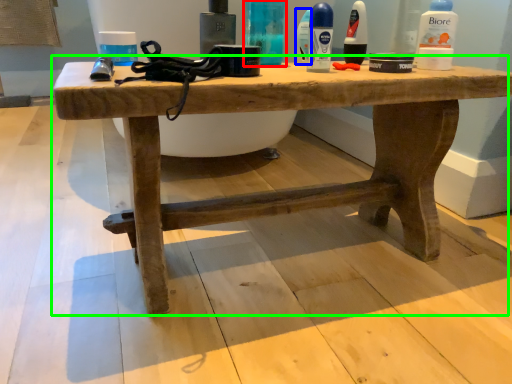
Question: Based on their relative distances, which object is farther from toiletry (highlighted by a red box)? Choose from mouthwash (highlighted by a blue box) and table (highlighted by a green box).

Choices:
 (A) mouthwash
 (B) table

Answer: (B)